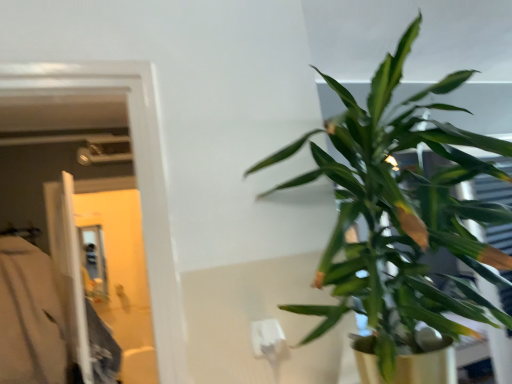
Measure the distance between green leafy plant at right and camera.

green leafy plant at right is 27.20 inches away from camera.

This screenshot has width=512, height=384. Describe the element at coordinates (400, 216) in the screenshot. I see `green leafy plant at right` at that location.

I want to click on green leafy plant at right, so click(x=400, y=216).

Identify the location of green leafy plant at right. This screenshot has width=512, height=384. (400, 216).